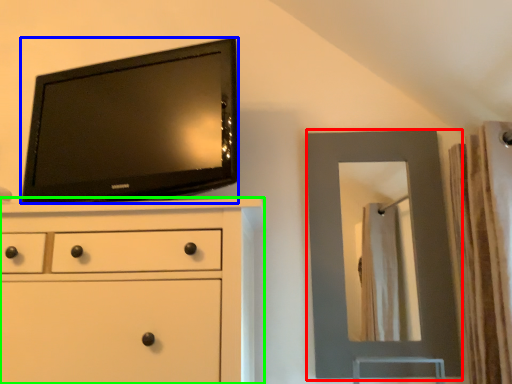
Question: Which is farther away from mirror (highlighted by a red box)? television (highlighted by a blue box) or chest of drawers (highlighted by a green box)?

Choices:
 (A) television
 (B) chest of drawers

Answer: (B)